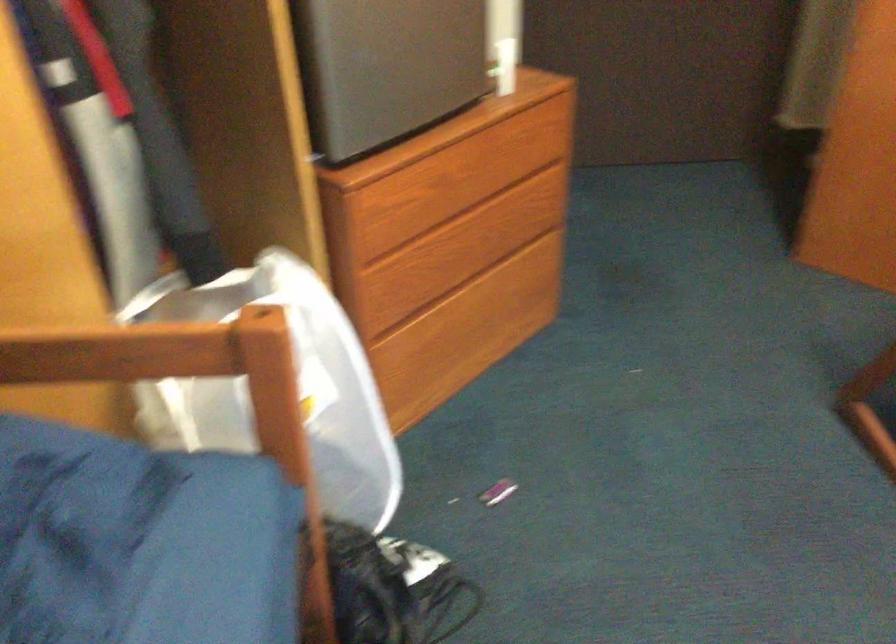
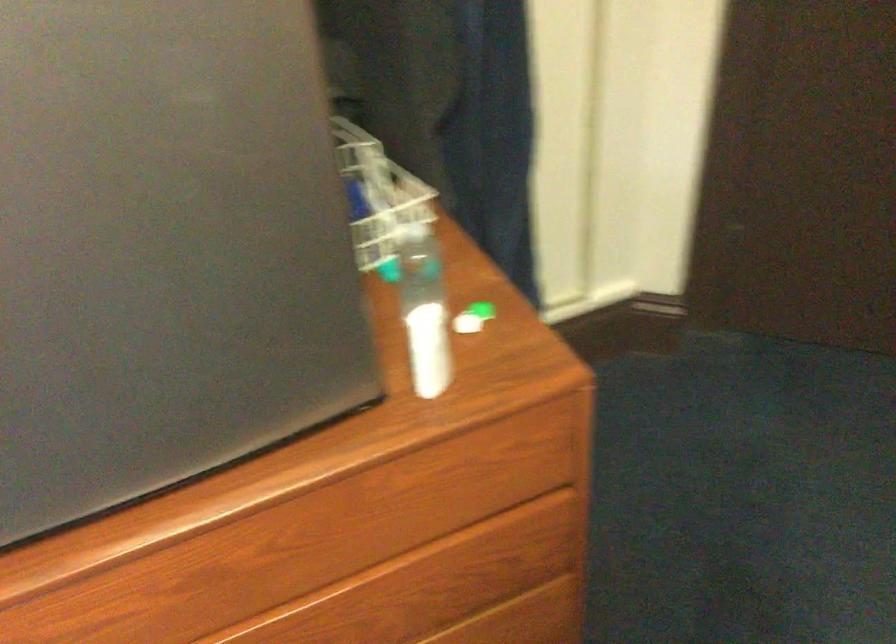
Find the pixel in the second image that matches the point at 494,68 in the first image.

(480, 308)